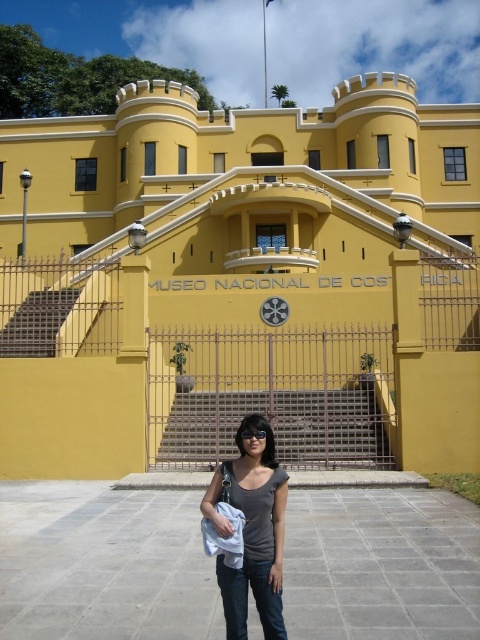
Which is below, yellow matte building at center or gray matte shirt at center?

gray matte shirt at center is below.

Who is taller, yellow matte building at center or gray matte shirt at center?

Standing taller between the two is yellow matte building at center.

Who is more distant from viewer, (91, 442) or (250, 422)?

Point (91, 442)

The width and height of the screenshot is (480, 640). Find the location of `yellow matte building at center`. yellow matte building at center is located at coordinates (240, 284).